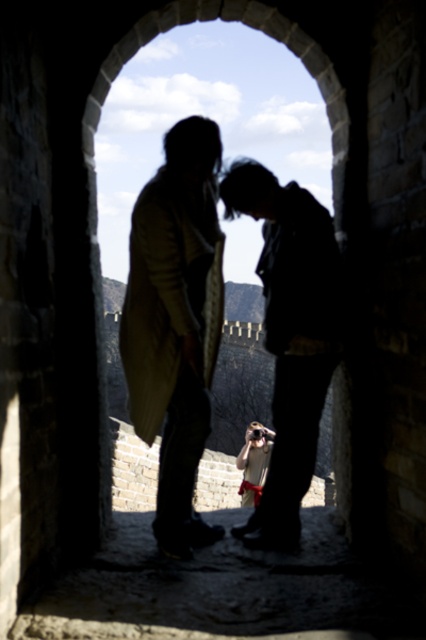
Question: Which point is farther to the camera?

Choices:
 (A) (285, 390)
 (B) (170, 513)
 (C) (184, 262)

Answer: (A)

Question: Where is silhouette clothing at center located in relation to matte black jacket at center in the image?

Choices:
 (A) above
 (B) below

Answer: (B)

Question: Is silhouette clothing at center further to camera compared to matte black jacket at center?

Choices:
 (A) yes
 (B) no

Answer: (B)

Question: Considering the real-world distances, which object is closest to the matte black jacket at center?

Choices:
 (A) silhouette coat at center
 (B) silhouette clothing at center

Answer: (A)

Question: Estimate the real-world distances between objects in this image. Which object is farther from the silhouette clothing at center?

Choices:
 (A) matte black jacket at center
 (B) silhouette coat at center

Answer: (A)

Question: Does silhouette clothing at center appear on the right side of matte black jacket at center?

Choices:
 (A) yes
 (B) no

Answer: (B)